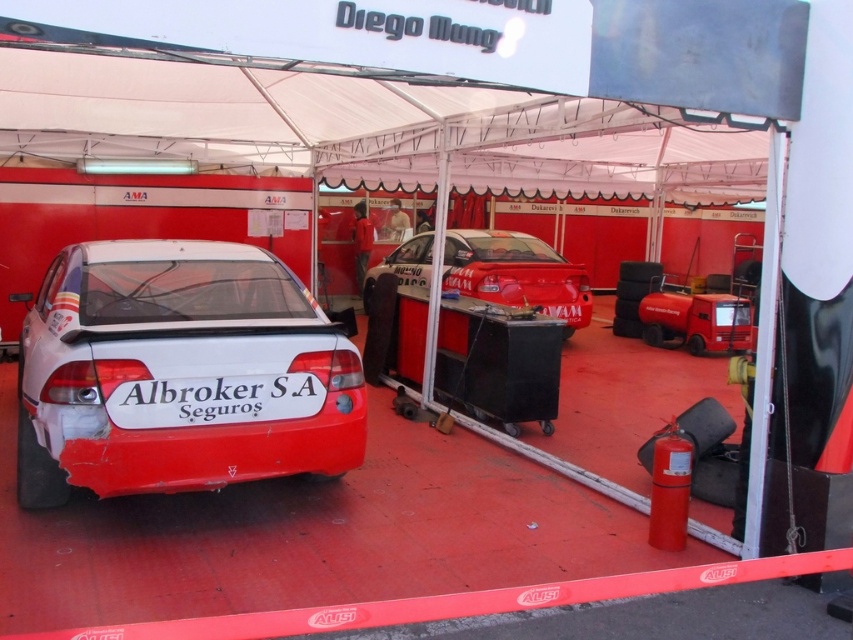
Question: Which point is closer to the camera taking this photo?

Choices:
 (A) (119, 328)
 (B) (498, 232)

Answer: (A)

Question: In this image, where is white glossy car at center located relative to glossy white car at center?

Choices:
 (A) left
 (B) right

Answer: (A)

Question: Can you confirm if white glossy car at center is thinner than glossy white car at center?

Choices:
 (A) no
 (B) yes

Answer: (A)

Question: Which point is farther to the camera?

Choices:
 (A) white glossy car at center
 (B) glossy white car at center

Answer: (B)

Question: From the image, what is the correct spatial relationship of white glossy car at center in relation to glossy white car at center?

Choices:
 (A) right
 (B) left

Answer: (B)